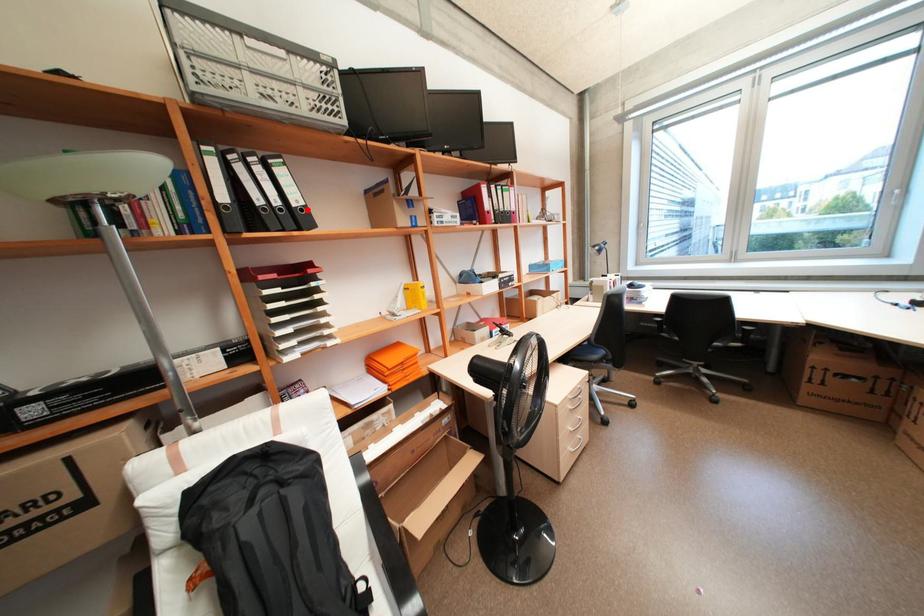
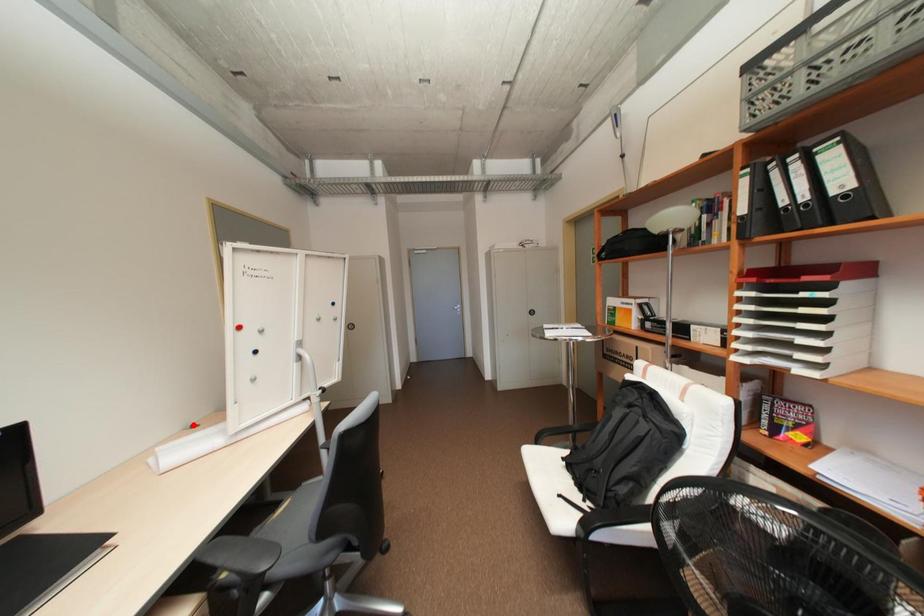
I am providing you with two images of the same scene from different viewpoints. A red point is marked on the first image and another point is marked on the second image. Is the marked point in image1 the same physical position as the marked point in image2?

No